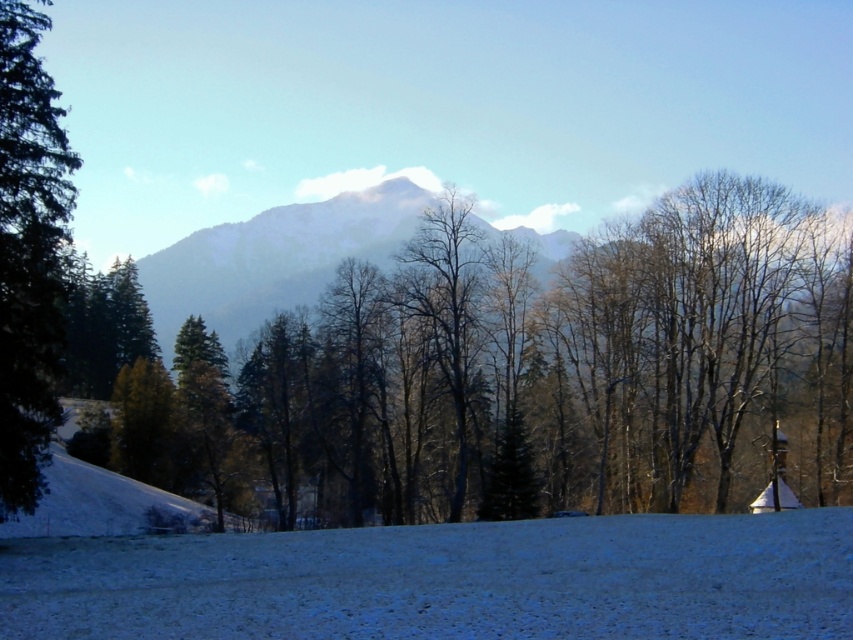
Question: Is white snow at lower center below green matte tree at left?

Choices:
 (A) yes
 (B) no

Answer: (A)

Question: Which point appears farthest from the camera in this image?

Choices:
 (A) (122, 621)
 (B) (22, 216)

Answer: (B)

Question: Is white snow at lower center behind green matte tree at left?

Choices:
 (A) no
 (B) yes

Answer: (A)

Question: Observing the image, what is the correct spatial positioning of white snow at lower center in reference to green matte tree at left?

Choices:
 (A) right
 (B) left

Answer: (A)

Question: Which object appears closest to the camera in this image?

Choices:
 (A) white snow at lower center
 (B) green matte tree at left

Answer: (A)